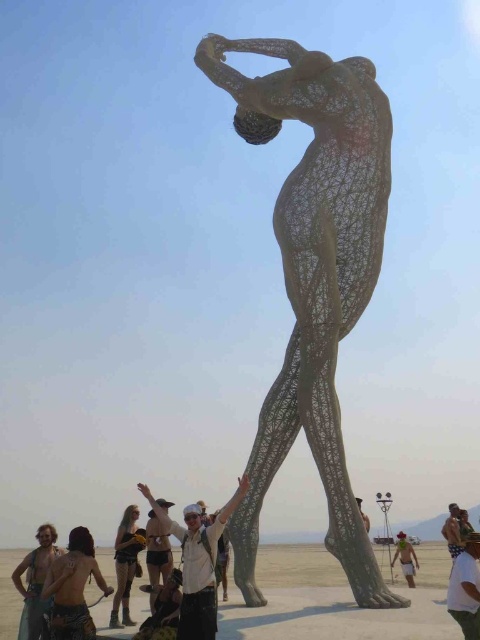
You are a photographer trying to capture the matte gray sculpture at center without any people in the frame. The white cotton shirt at lower center is blocking your view. Can you move around to the left side of the sculpture to get a clear shot?

The white cotton shirt at lower center is in front of the matte gray sculpture at center, so moving to the left side of the sculpture may allow you to avoid the obstruction caused by the shirt and capture the sculpture without any people in the frame.

You are a photographer at the sculpture. You want to take a photo of the white cotton shirt at lower center and the matte black shorts at lower left. Can you see both in the same photo without moving the camera?

The white cotton shirt at lower center is in front of the matte black shorts at lower left, so both can be seen in the same photo as long as the camera captures the area where they are positioned, with the white cotton shirt at lower center overlapping but still visible alongside the matte black shorts at lower left.

You are a photographer standing at the edge of the scene. You want to take a photo that includes both the white cotton shirt at lower center and the matte gray sculpture at center. Based on their positions, which object is closer to the left edge of your camera frame?

The white cotton shirt at lower center is positioned on the left side of matte gray sculpture at center, so it is closer to the left edge of the camera frame.